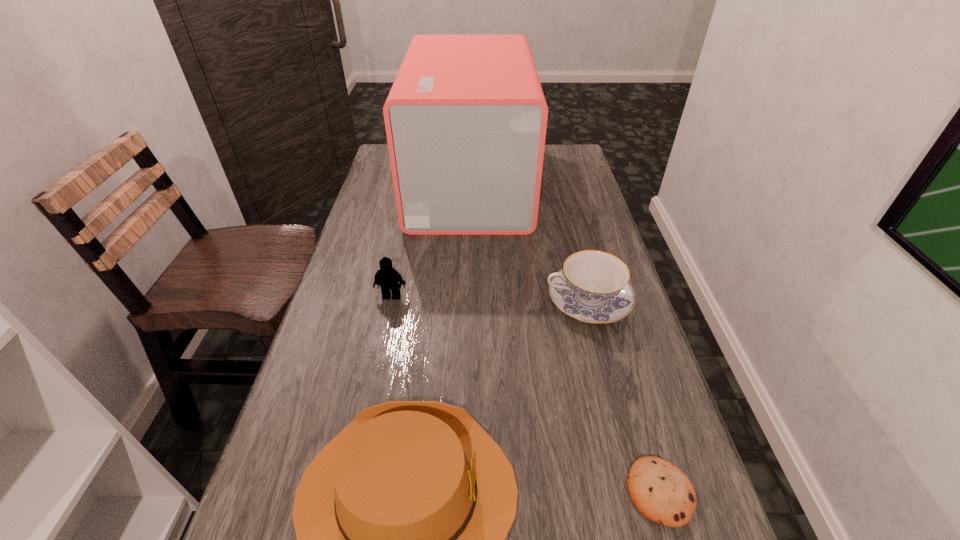
Where is `object that is the closest one to the farthest object`? object that is the closest one to the farthest object is located at coordinates (593, 286).

Identify which object is the second nearest to the Lego. Please provide its 2D coordinates. Your answer should be formatted as a tuple, i.e. [(x, y)], where the tuple contains the x and y coordinates of a point satisfying the conditions above.

[(401, 519)]

Where is `free space that satisfies the following two spatial constraints: 1. on the surface of the farthest object where the text is embossed; 2. on the face of the Lego`? This screenshot has width=960, height=540. free space that satisfies the following two spatial constraints: 1. on the surface of the farthest object where the text is embossed; 2. on the face of the Lego is located at coordinates (467, 296).

In order to click on free location that satisfies the following two spatial constraints: 1. on the face of the Lego; 2. with the handle on the side of the chinaware in this screenshot , I will do `click(391, 301)`.

You are a GUI agent. You are given a task and a screenshot of the screen. Output one action in this format:
    pyautogui.click(x=<x>, y=<y>)
    Task: Click on the vacant region that satisfies the following two spatial constraints: 1. on the surface of the cookie where the text is embossed; 2. on the right side of the box
    
    Given the screenshot: What is the action you would take?
    pyautogui.click(x=461, y=492)

What are the coordinates of `free space that satisfies the following two spatial constraints: 1. with the handle on the side of the chinaware; 2. on the face of the Lego` in the screenshot? It's located at tap(587, 296).

Locate an element on the screen. The height and width of the screenshot is (540, 960). free spot that satisfies the following two spatial constraints: 1. on the back side of the cookie; 2. on the surface of the farthest object where the text is embossed is located at coordinates (569, 184).

Locate an element on the screen. Image resolution: width=960 pixels, height=540 pixels. free location that satisfies the following two spatial constraints: 1. on the surface of the tallest object where the text is embossed; 2. with the handle on the side of the chinaware is located at coordinates (467, 301).

This screenshot has height=540, width=960. What are the coordinates of `blank space that satisfies the following two spatial constraints: 1. on the face of the Lego; 2. with the handle on the side of the chinaware` in the screenshot? It's located at (391, 301).

You are a GUI agent. You are given a task and a screenshot of the screen. Output one action in this format:
    pyautogui.click(x=<x>, y=<y>)
    Task: Click on the vacant space that satisfies the following two spatial constraints: 1. on the surface of the tallest object where the text is embossed; 2. on the left side of the shortest object
    
    Given the screenshot: What is the action you would take?
    pyautogui.click(x=461, y=492)